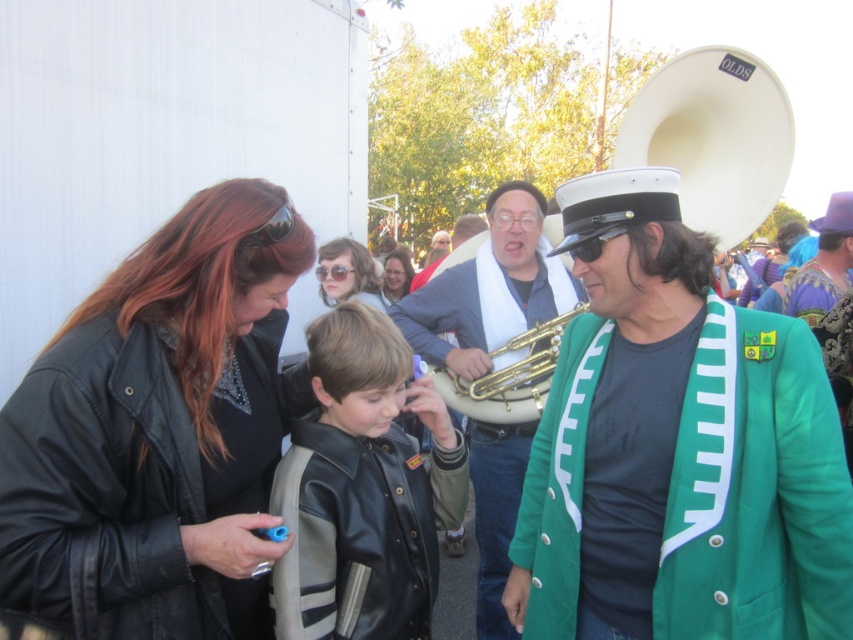
Question: Does matte black sunglasses at center come in front of matte black goggles at upper left?

Choices:
 (A) yes
 (B) no

Answer: (B)

Question: Can you confirm if leather jacket at left is smaller than gold brass tuba at center?

Choices:
 (A) yes
 (B) no

Answer: (A)

Question: Which of the following is the farthest from the observer?

Choices:
 (A) (553, 333)
 (B) (672, 300)

Answer: (A)

Question: Considering the real-world distances, which object is closest to the black leather jacket at center?

Choices:
 (A) leather jacket at left
 (B) gold brass trumpet at center
 (C) green woolen blazer at right
 (D) matte black sunglasses at center

Answer: (A)

Question: Which of the following is the farthest from the observer?

Choices:
 (A) clear plastic goggles at center
 (B) matte black sunglasses at upper center
 (C) matte black goggles at upper left

Answer: (B)

Question: Can you confirm if gold brass trumpet at center is smaller than matte black goggles at upper left?

Choices:
 (A) yes
 (B) no

Answer: (B)